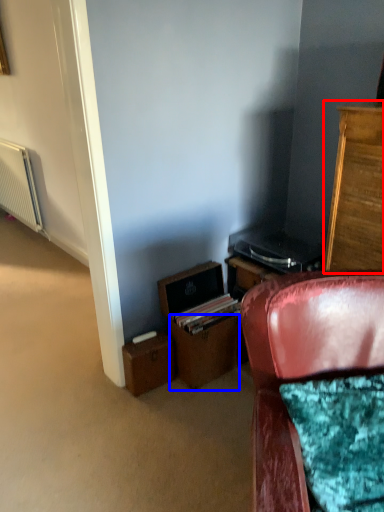
Question: Which point is closer to the camera, cabinetry (highlighted by a red box) or drawer (highlighted by a blue box)?

Choices:
 (A) cabinetry
 (B) drawer

Answer: (A)